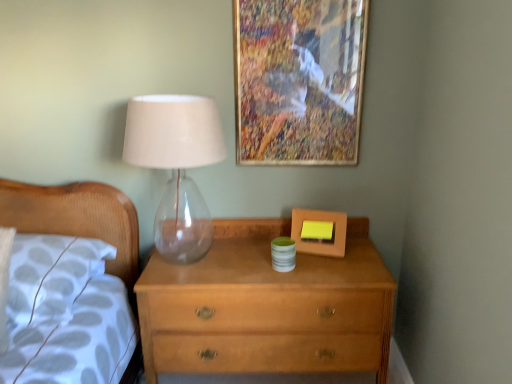
Where is `vacant region above light brown wood chest of drawers at center (from a real-world perspective)`? vacant region above light brown wood chest of drawers at center (from a real-world perspective) is located at coordinates (269, 249).